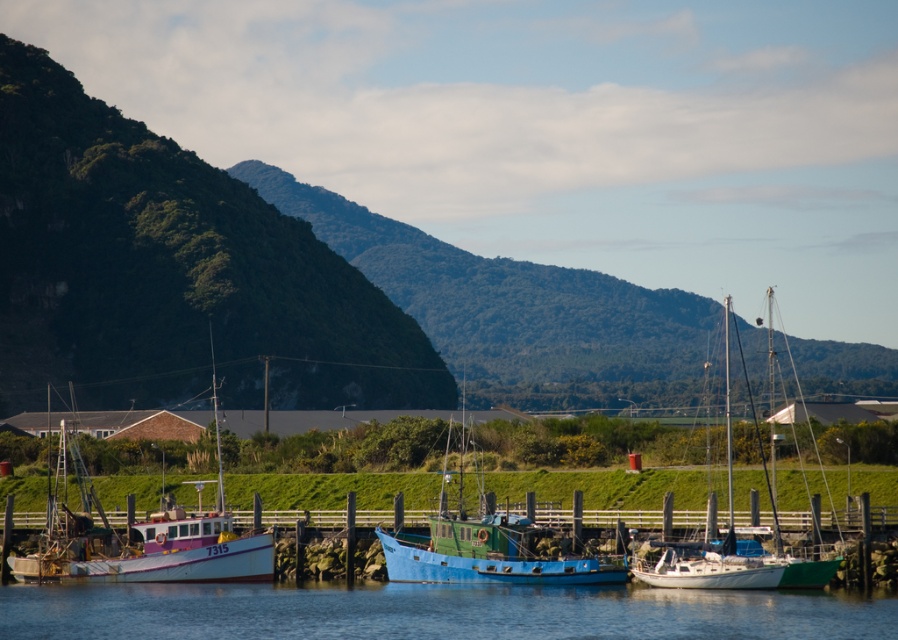
Question: Among these points, which one is nearest to the camera?

Choices:
 (A) (324, 269)
 (B) (602, 582)
 (C) (603, 620)
 (D) (253, 568)

Answer: (C)

Question: Can you confirm if green forested mountain at upper left is positioned to the right of blue water at center?

Choices:
 (A) no
 (B) yes

Answer: (A)

Question: Which of the following is the farthest from the observer?

Choices:
 (A) white matte sailboat at center
 (B) green forested mountain at upper left

Answer: (B)

Question: Which object is closer to the camera taking this photo?

Choices:
 (A) blue matte boat at center
 (B) green forested mountain at upper left
 (C) white matte sailboat at center
 (D) white-painted wooden fishing boat at lower left

Answer: (C)

Question: Is blue water at center smaller than white matte sailboat at center?

Choices:
 (A) yes
 (B) no

Answer: (A)

Question: Does green forested mountain at upper left appear over white matte sailboat at center?

Choices:
 (A) no
 (B) yes

Answer: (B)